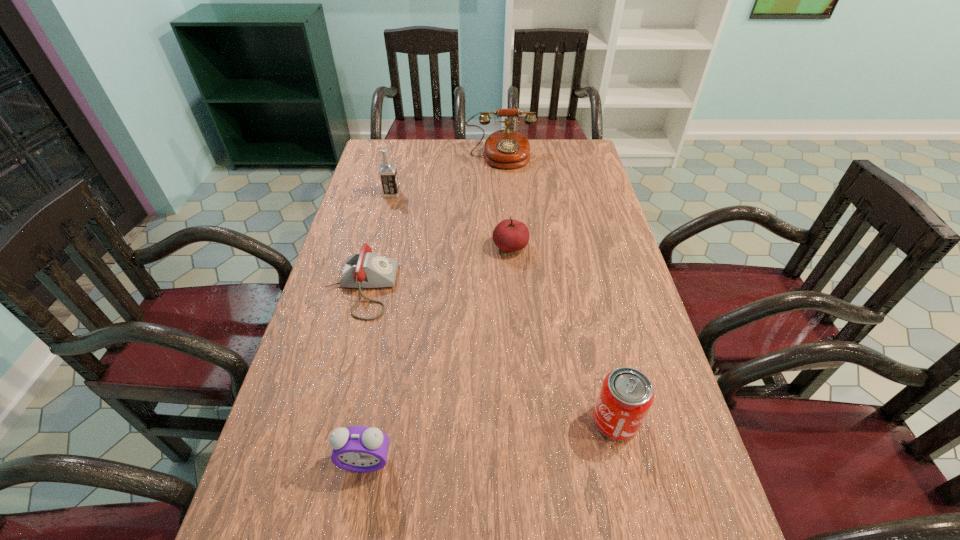
Identify the location of unoccupied area between the vodka and the second nearest object. The image size is (960, 540). (503, 307).

You are a GUI agent. You are given a task and a screenshot of the screen. Output one action in this format:
    pyautogui.click(x=<x>, y=<y>)
    Task: Click on the vacant space that is in between the fifth nearest object and the right telephone
    
    Given the screenshot: What is the action you would take?
    pyautogui.click(x=446, y=176)

Locate an element on the screen. free space between the can and the farthest object is located at coordinates tap(558, 289).

This screenshot has width=960, height=540. Find the location of `blank region between the fourth shortest object and the vodka`. blank region between the fourth shortest object and the vodka is located at coordinates (503, 307).

Where is `free point between the alarm clock and the shorter telephone`? Image resolution: width=960 pixels, height=540 pixels. free point between the alarm clock and the shorter telephone is located at coordinates (363, 375).

Identify the location of object that stands as the closest to the nearest object. Image resolution: width=960 pixels, height=540 pixels. (364, 269).

Locate which object is the closest to the vodka. Please provide its 2D coordinates. Your answer should be formatted as a tuple, i.e. [(x, y)], where the tuple contains the x and y coordinates of a point satisfying the conditions above.

[(507, 149)]

You are a GUI agent. You are given a task and a screenshot of the screen. Output one action in this format:
    pyautogui.click(x=<x>, y=<y>)
    Task: Click on the vacant space that satisfies the following two spatial constraints: 1. on the dial of the tomato; 2. on the left side of the right telephone
    The image size is (960, 540).
    Given the screenshot: What is the action you would take?
    pyautogui.click(x=506, y=247)

Find the location of a particular element. The image size is (960, 540). vacant position in the image that satisfies the following two spatial constraints: 1. on the dial of the taller telephone; 2. on the front label of the vodka is located at coordinates (503, 194).

Where is `free space that satisfies the following two spatial constraints: 1. on the front label of the fifth nearest object; 2. on the right side of the can`? This screenshot has width=960, height=540. free space that satisfies the following two spatial constraints: 1. on the front label of the fifth nearest object; 2. on the right side of the can is located at coordinates (335, 421).